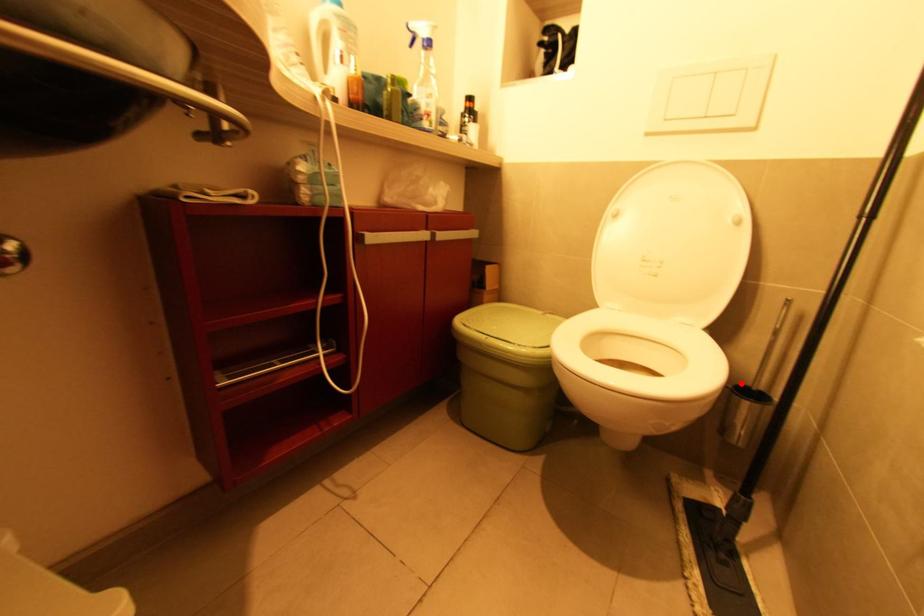
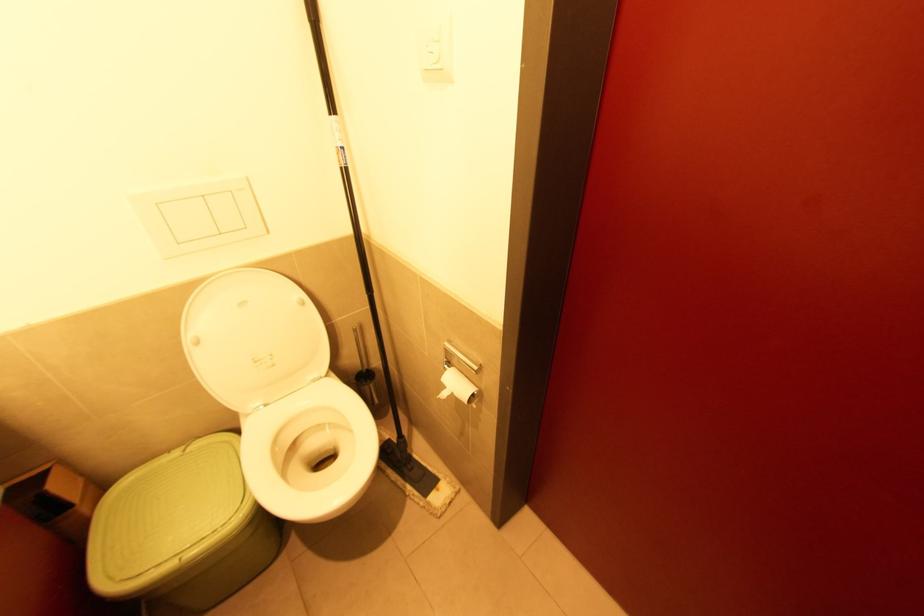
Question: A red point is marked in image1. In image2, is the corresponding 3D point closer to the camera or farther? Reply with the corresponding letter.

Choices:
 (A) The corresponding 3D point is closer.
 (B) The corresponding 3D point is farther.

Answer: (B)